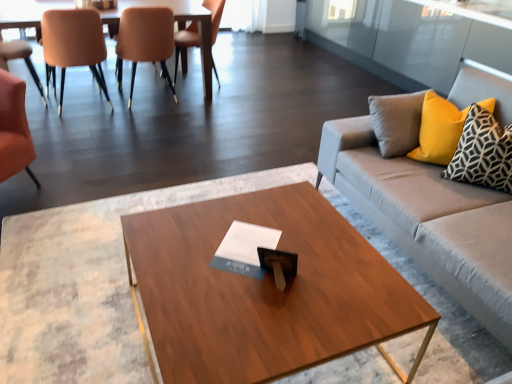
Locate an element on the screen. The image size is (512, 384). vacant area in front of wooden table at upper left is located at coordinates (119, 144).